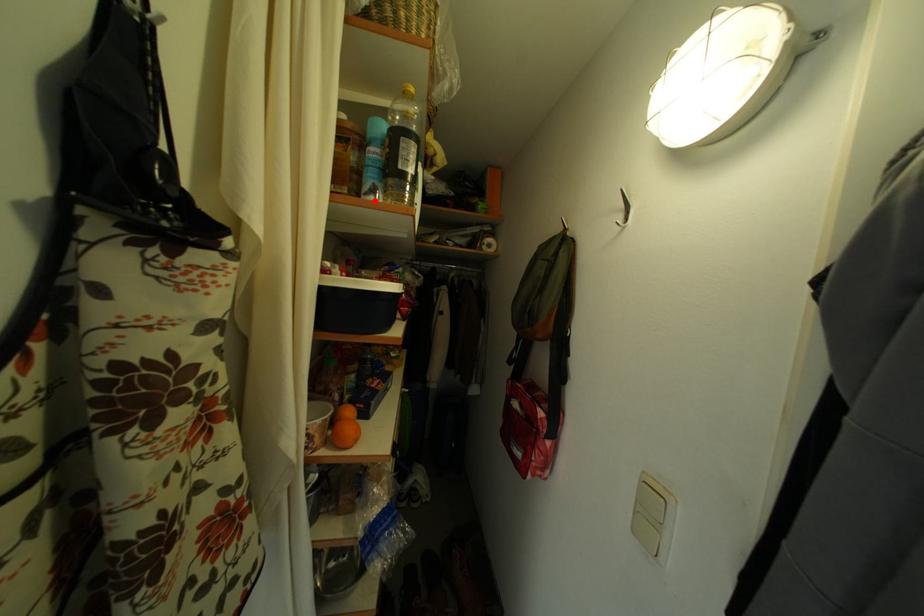
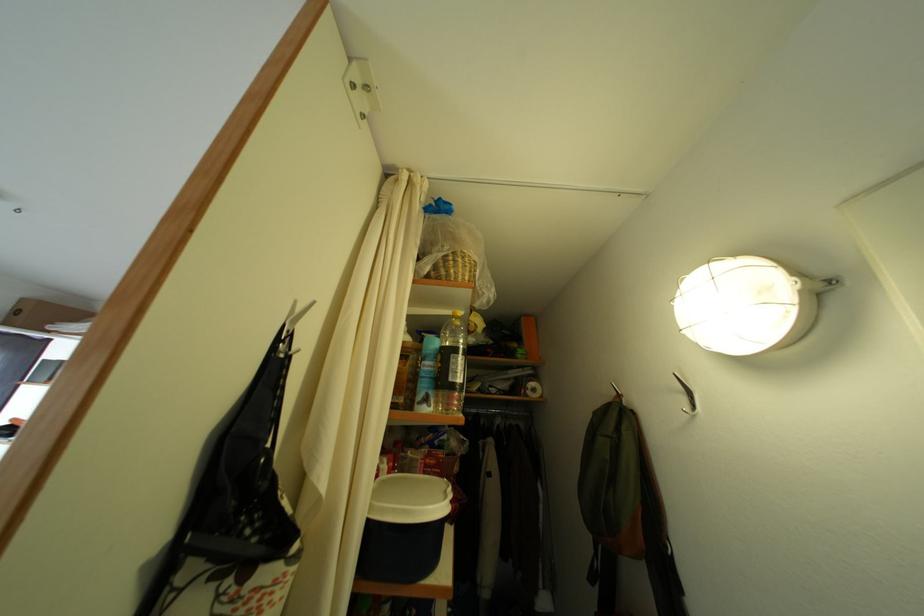
In the second image, find the point that corresponds to the highlighted location in the first image.

(428, 410)